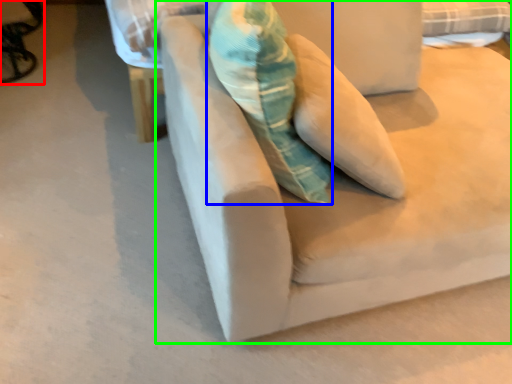
Question: Estimate the real-world distances between objects in this image. Which object is farther from swivel chair (highlighted by a red box), throw pillow (highlighted by a blue box) or studio couch (highlighted by a green box)?

Choices:
 (A) throw pillow
 (B) studio couch

Answer: (B)